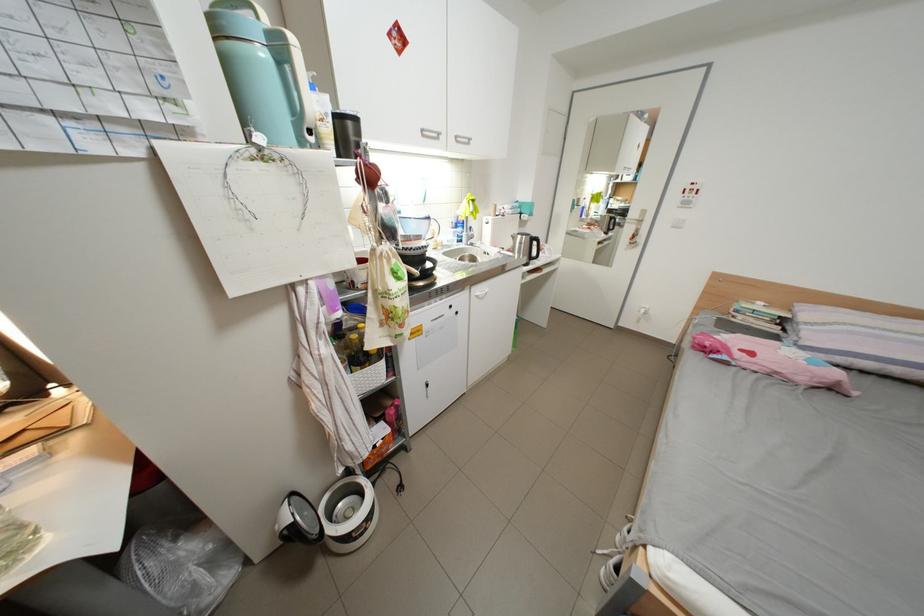
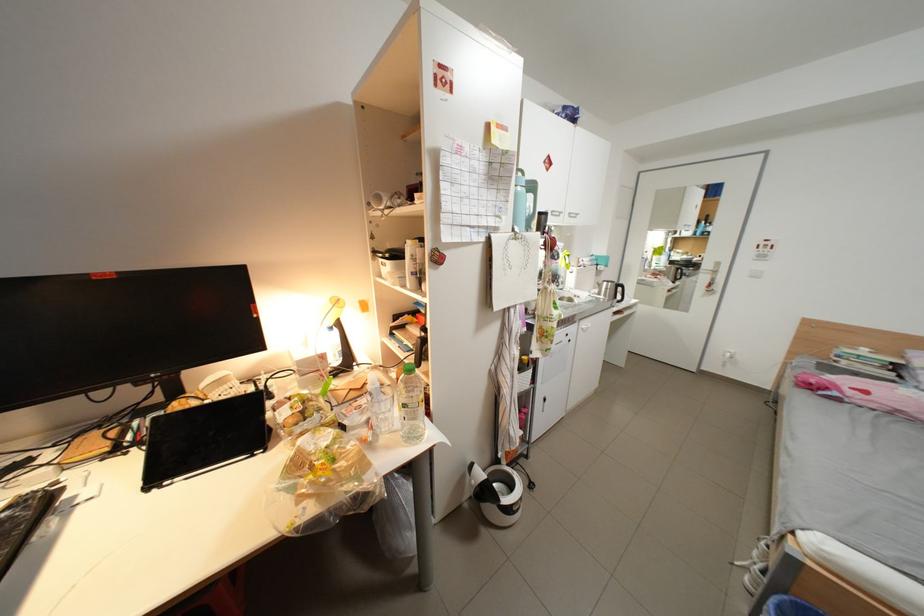
In the second image, find the point that corresponds to the point at 496,254 in the first image.

(587, 297)